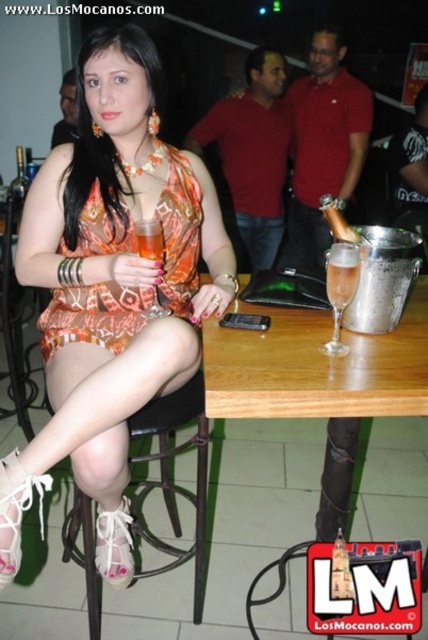
Question: Based on their relative distances, which object is farther from the clear glass at center?

Choices:
 (A) translucent glass at center
 (B) clear glass champagne flute at table center
 (C) orange printed fabric dress at center
 (D) wooden table at center

Answer: (C)

Question: Can you confirm if orange printed dress at center is bigger than clear glass champagne flute at table center?

Choices:
 (A) no
 (B) yes

Answer: (B)

Question: Based on their relative distances, which object is farther from the translucent glass at center?

Choices:
 (A) orange printed dress at center
 (B) wooden table at center
 (C) clear glass champagne flute at table center

Answer: (B)

Question: Based on their relative distances, which object is nearer to the clear glass champagne flute at table center?

Choices:
 (A) black leather bar stool at lower left
 (B) orange printed dress at center

Answer: (B)

Question: Is wooden table at center above black leather bar stool at lower left?

Choices:
 (A) no
 (B) yes

Answer: (B)

Question: Can you confirm if clear glass at center is smaller than translucent glass at center?

Choices:
 (A) yes
 (B) no

Answer: (A)